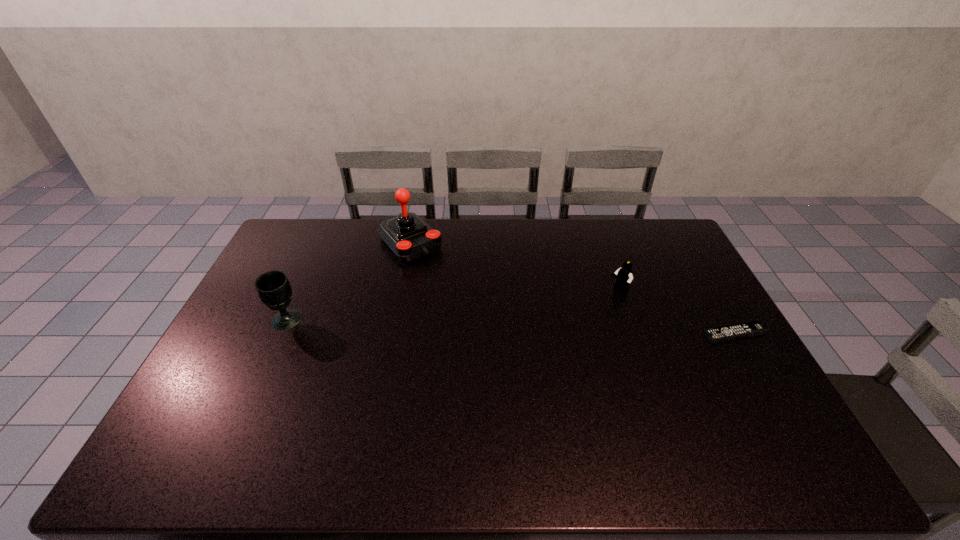
You are a GUI agent. You are given a task and a screenshot of the screen. Output one action in this format:
    pyautogui.click(x=<x>, y=<y>)
    Task: Click on the chalice
    The height and width of the screenshot is (540, 960).
    Given the screenshot: What is the action you would take?
    pyautogui.click(x=273, y=287)

You are a GUI agent. You are given a task and a screenshot of the screen. Output one action in this format:
    pyautogui.click(x=<x>, y=<y>)
    Task: Click on the second tallest object
    
    Given the screenshot: What is the action you would take?
    coord(273,287)

At what (x,y) coordinates should I click in order to perform the action: click on the shortest object. Please return your answer as a coordinate pair (x, y). The height and width of the screenshot is (540, 960). Looking at the image, I should click on (753, 328).

Find the location of `the rightmost object`. the rightmost object is located at coordinates (753, 328).

I want to click on the second shortest object, so click(624, 274).

Find the location of `the second object from right to left`. the second object from right to left is located at coordinates (624, 274).

This screenshot has height=540, width=960. I want to click on joystick, so coord(407,235).

Image resolution: width=960 pixels, height=540 pixels. Identify the location of the second object from left to right. (407, 235).

You are a GUI agent. You are given a task and a screenshot of the screen. Output one action in this format:
    pyautogui.click(x=<x>, y=<y>)
    Task: Click on the free space located on the back of the chalice
    
    Given the screenshot: What is the action you would take?
    pyautogui.click(x=319, y=248)

You are a GUI agent. You are given a task and a screenshot of the screen. Output one action in this format:
    pyautogui.click(x=<x>, y=<y>)
    Task: Click on the free space located 0.220m on the front of the rightmost object
    The image size is (960, 540).
    Given the screenshot: What is the action you would take?
    pyautogui.click(x=779, y=409)